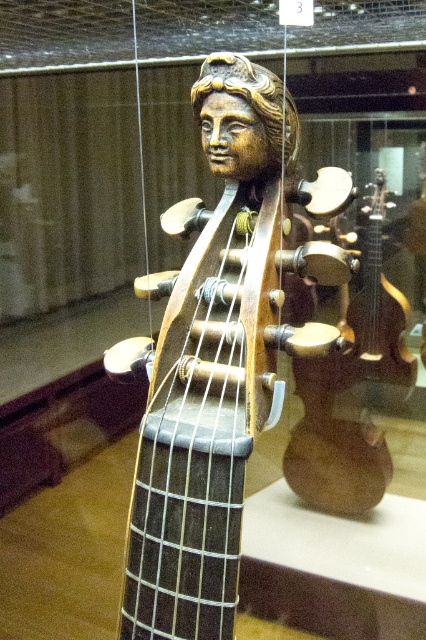
Question: Is wooden carved head at center below shiny gold guitar at center?

Choices:
 (A) no
 (B) yes

Answer: (B)

Question: Which of the following is the farthest from the observer?

Choices:
 (A) (294, 435)
 (B) (187, 483)

Answer: (A)

Question: Is wooden carved head at center thinner than shiny gold guitar at center?

Choices:
 (A) yes
 (B) no

Answer: (B)

Question: Is wooden carved head at center thinner than shiny gold guitar at center?

Choices:
 (A) no
 (B) yes

Answer: (A)

Question: Which object appears farthest from the camera in this image?

Choices:
 (A) shiny gold guitar at center
 (B) wooden carved head at center

Answer: (A)